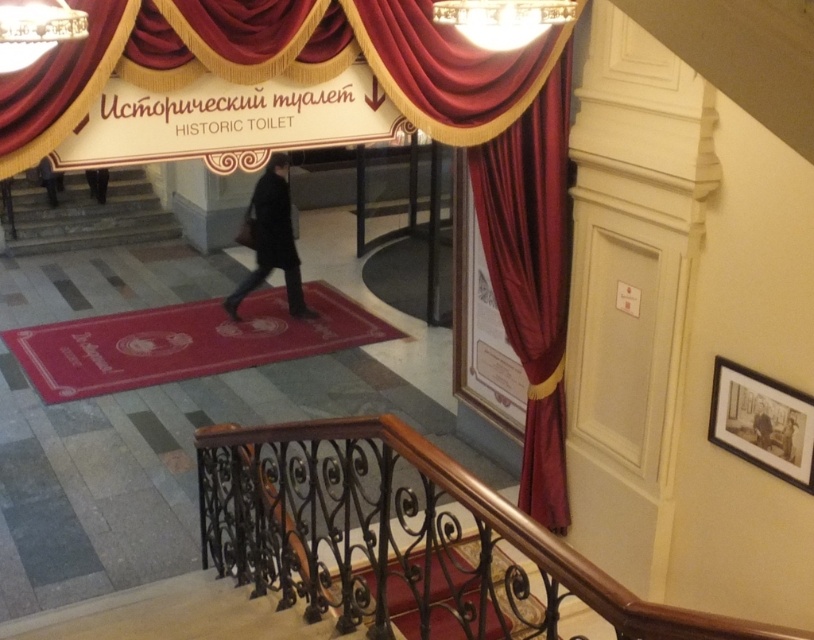
What is the spatial relationship between the velvet red curtain at upper left and the dark gray fabric coat at lower left in the historic building?

The velvet red curtain at upper left is located to the right of the dark gray fabric coat at lower left.

You are an architect visiting the Historic Toilet exhibit. You notice a point marked at coordinates (60, 84) in the image. Based on the scene description, what does this point indicate?

The point at coordinates (60, 84) marks the velvet red curtain at upper left.

You are a tour guide explaining the historic building to visitors. You point out the velvet red curtain at upper left and the dark matte coat at center. Which object is shorter in height?

The velvet red curtain at upper left is not as tall as the dark matte coat at center, so the velvet red curtain at upper left is shorter in height.